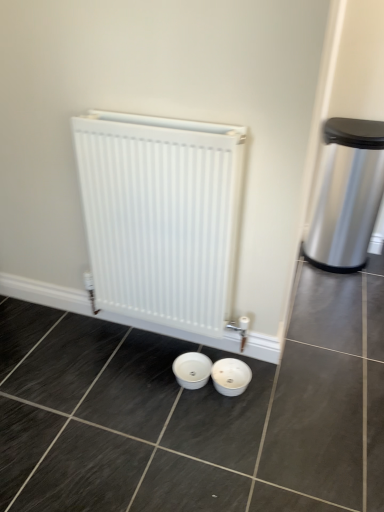
Question: In terms of width, does polished stainless steel trash can at right look wider or thinner when compared to white glossy basin at center?

Choices:
 (A) thin
 (B) wide

Answer: (B)

Question: Looking at the image, does polished stainless steel trash can at right seem bigger or smaller compared to white glossy basin at center?

Choices:
 (A) small
 (B) big

Answer: (B)

Question: Estimate the real-world distances between objects in this image. Which object is farther from the white matte radiator at center?

Choices:
 (A) white glossy basin at center
 (B) polished stainless steel trash can at right

Answer: (B)

Question: Which object is positioned closest to the white glossy basin at center?

Choices:
 (A) polished stainless steel trash can at right
 (B) white matte radiator at center

Answer: (B)